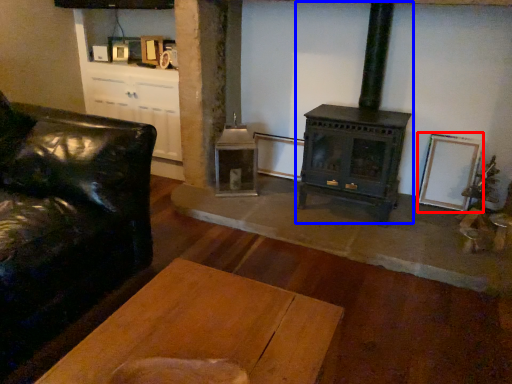
Question: Which of the following is the closest to the observer, picture frame (highlighted by a red box) or wood burning stove (highlighted by a blue box)?

Choices:
 (A) picture frame
 (B) wood burning stove

Answer: (B)